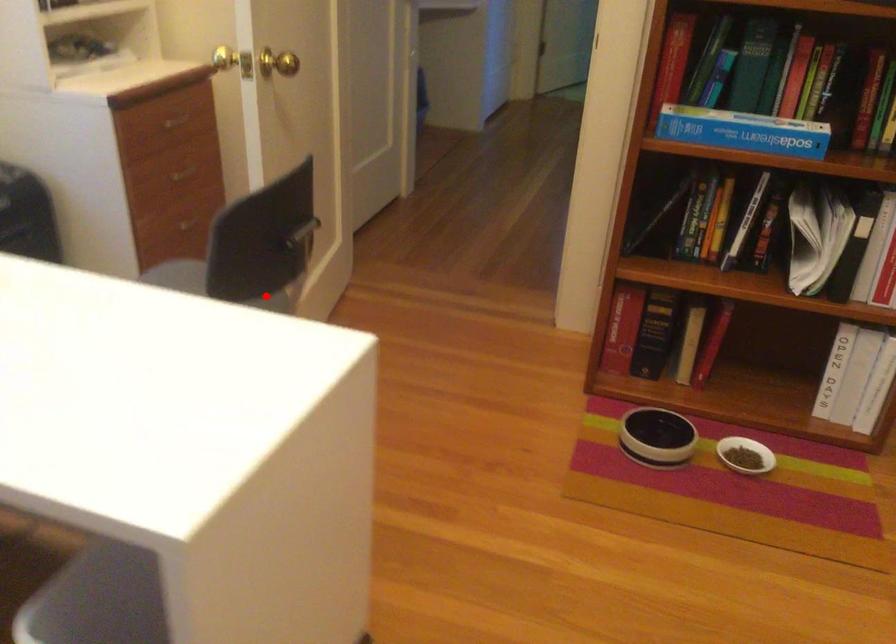
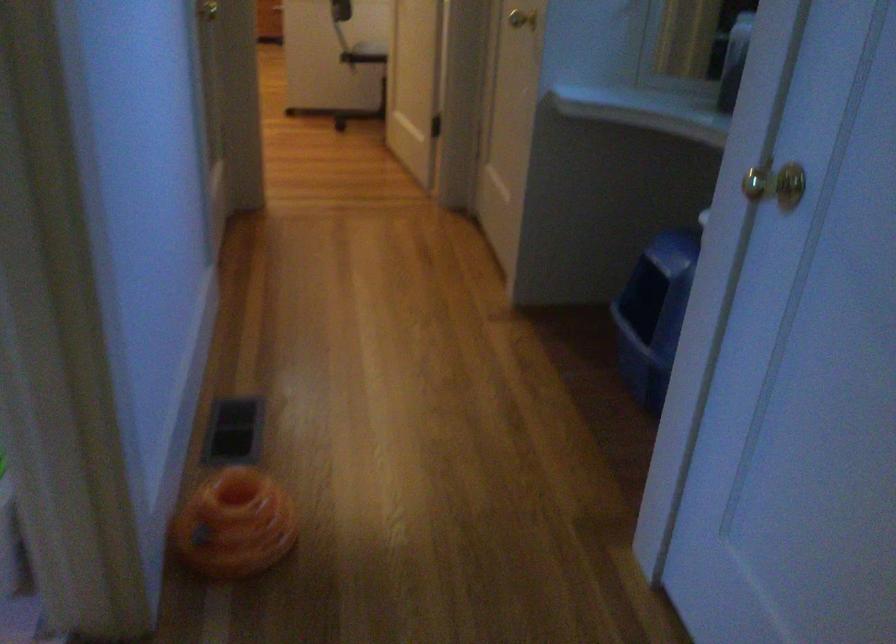
The point at the highlighted location is marked in the first image. Where is the corresponding point in the second image?

(371, 49)